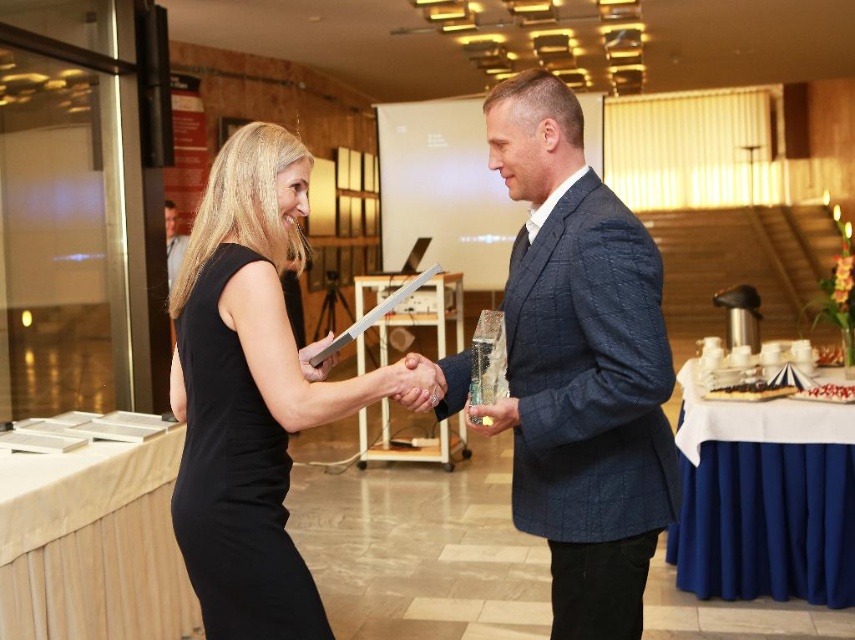
You are standing in the formal event venue and want to move from the point at coordinates point (508,403) to the point at coordinates point (78,556). Which direction should you face to walk towards the second point?

You should face downward because point (508,403) is closer to the viewer than point (78,556), so the second point is located below the first point.

Looking at this image, you are a photographer at the event and need to place a small microphone stand between the wooden table at center and the clear acrylic award at center. Based on their positions, where should you place the microphone stand so it is between them?

The wooden table at center is above the clear acrylic award at center, so the microphone stand should be placed below the wooden table at center and above the clear acrylic award at center to be between them.

You are attending an event and need to find the blue textured suit at center. Where is it located relative to the white fabric table at lower left?

The blue textured suit at center is to the right of the white fabric table at lower left.